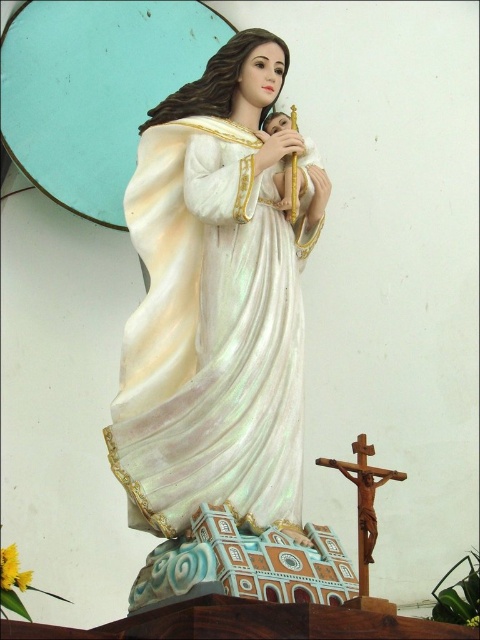
You are an art conservator examining the statue of the Virgin Mary and baby Jesus. You notice the iridescent fabric robe at center and the wooden crucifix at lower right. Which object is taller in the image?

The iridescent fabric robe at center is taller than the wooden crucifix at lower right.

You are standing at the point marked at coordinates (289, 234). You want to walk directly towards the statue of the Virgin Mary holding the baby Jesus. How far will you have to walk to reach the statue?

The distance between the point marked at coordinates (289, 234) and the statue of the Virgin Mary holding the baby Jesus is 71.30 meters, so you will have to walk 71.30 meters to reach the statue.